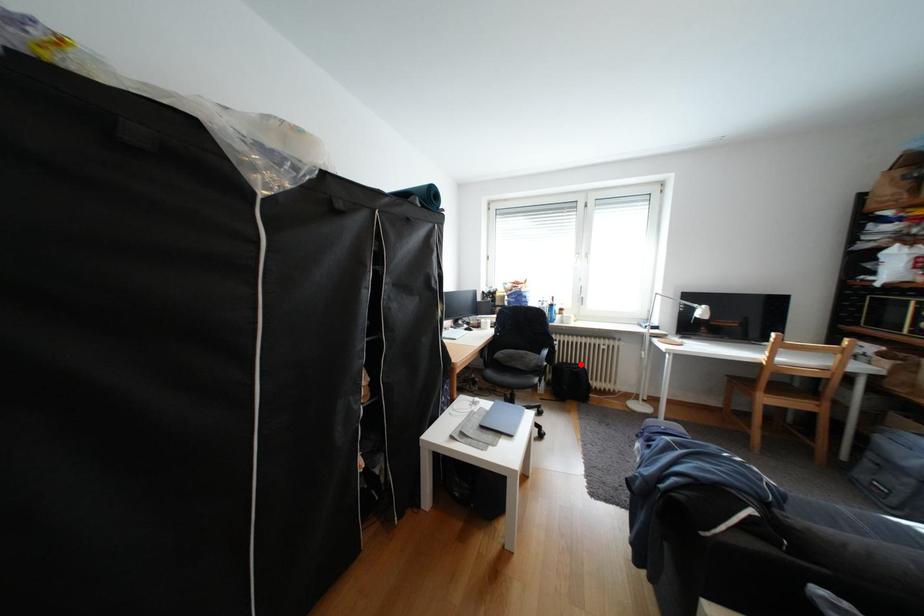
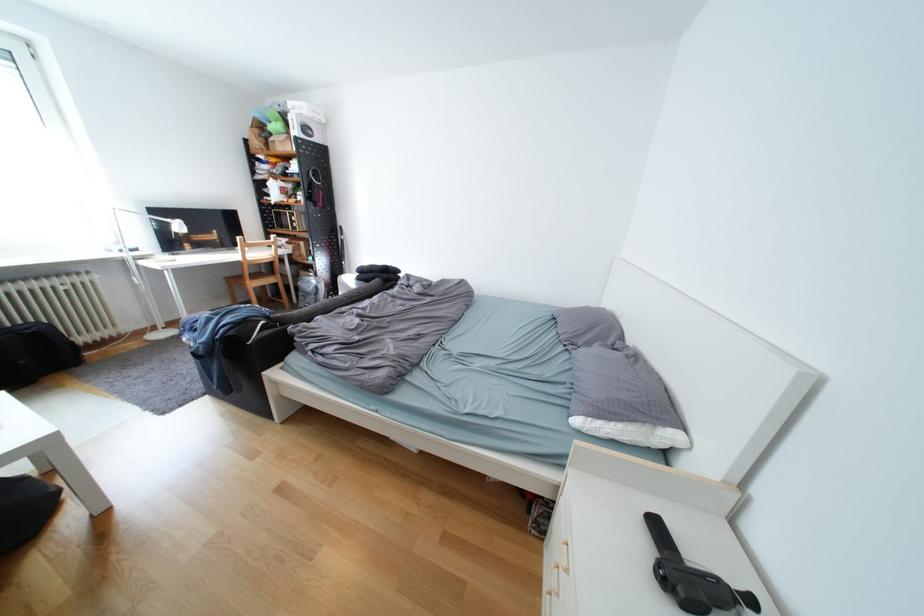
Where in the second image is the point corresponding to the highlighted location from the first image?

(14, 330)